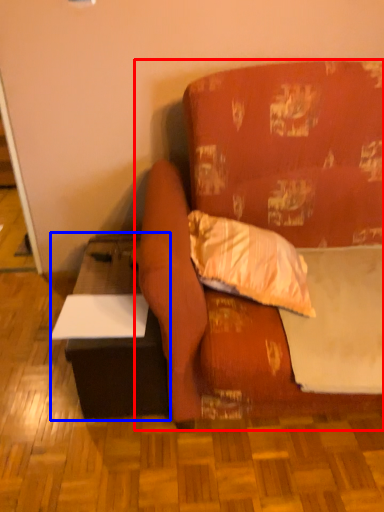
Question: Which object is closer to the camera taking this photo, studio couch (highlighted by a red box) or table (highlighted by a blue box)?

Choices:
 (A) studio couch
 (B) table

Answer: (A)